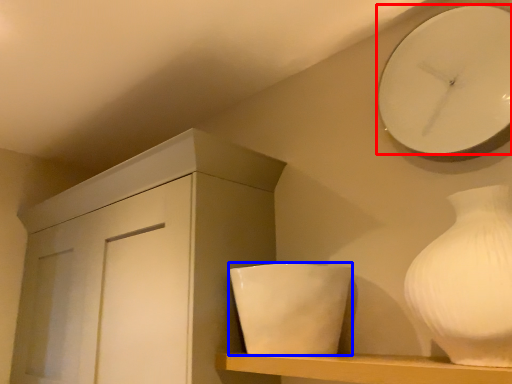
Question: Which object is further to the camera taking this photo, wall clock (highlighted by a red box) or ceramic (highlighted by a blue box)?

Choices:
 (A) wall clock
 (B) ceramic

Answer: (B)